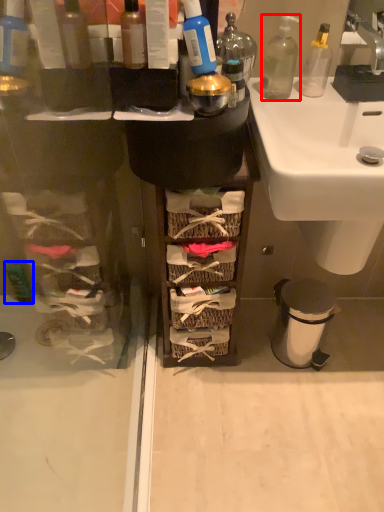
Question: Which object is further to the camera taking this photo, bottle (highlighted by a red box) or toiletry (highlighted by a blue box)?

Choices:
 (A) bottle
 (B) toiletry

Answer: (B)